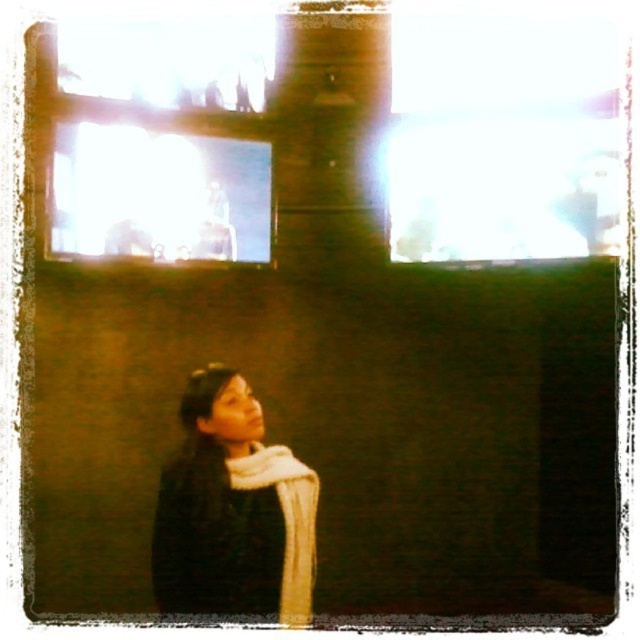
Does dark gray sweater at lower left have a larger size compared to transparent glass window at upper left?

Yes.

Between point (273, 488) and point (108, 224), which one is positioned in front?

Point (108, 224)

The width and height of the screenshot is (640, 640). I want to click on dark gray sweater at lower left, so click(x=232, y=509).